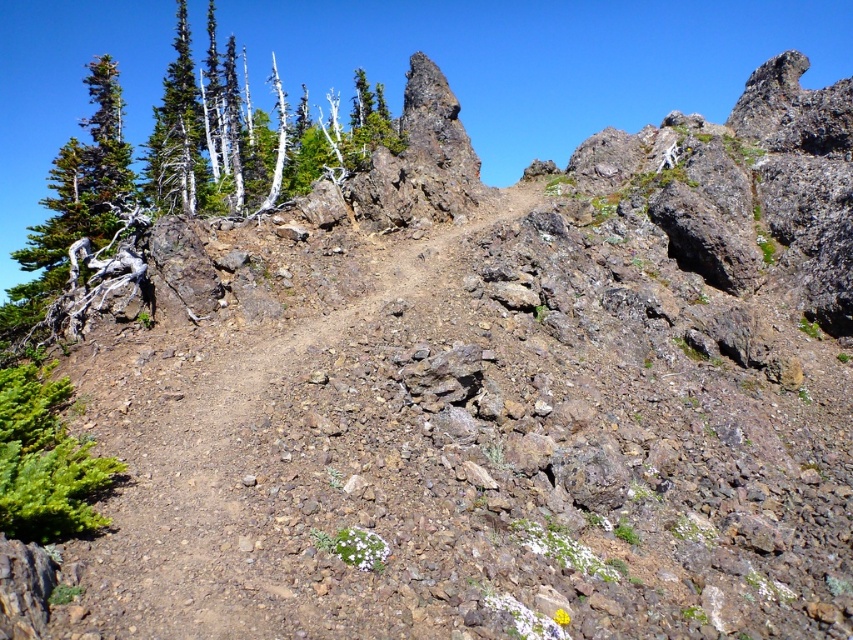
You are a hiker who wants to identify landmarks in the rocky terrain. There is a point marked at coordinates (144, 164). What object is located at that point?

The point at coordinates (144, 164) indicates a green matte tree at upper left.

From the picture: You are a hiker planning to walk along the brown dirt track at center. You notice a green matte tree at upper left in the distance. Which object would appear closer to you if you are standing at the starting point of the path?

The brown dirt track at center would appear closer because it is located at the center of the image, while the green matte tree at upper left is positioned further away in the upper left area.

Looking at this image, you are a hiker planning to take a photo of the brown dirt track at center and the green matte tree at upper left. Which object should you focus on first if you want both to be in sharp focus, considering their positions relative to the camera?

You should focus on the green matte tree at upper left first because it is closer to the camera than the brown dirt track at center, which is behind it. By focusing on the closer object, you can ensure both are in focus using the depth of field.